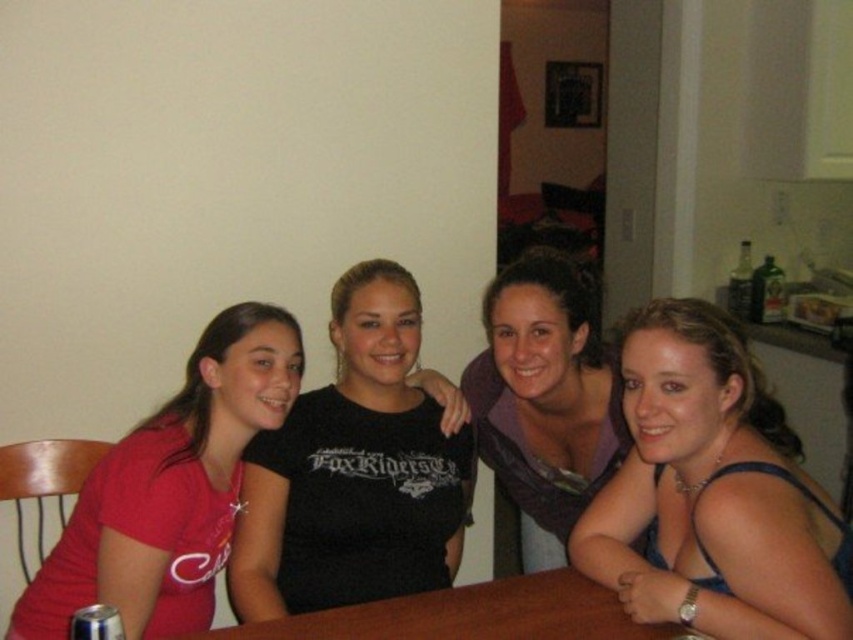
Can you confirm if blue fabric dress at center is positioned to the left of matte red shirt at left?

No, blue fabric dress at center is not to the left of matte red shirt at left.

Can you confirm if blue fabric dress at center is positioned to the right of matte red shirt at left?

Indeed, blue fabric dress at center is positioned on the right side of matte red shirt at left.

This screenshot has height=640, width=853. What do you see at coordinates (712, 493) in the screenshot?
I see `blue fabric dress at center` at bounding box center [712, 493].

Find the location of a particular element. This screenshot has height=640, width=853. blue fabric dress at center is located at coordinates (712, 493).

Can you confirm if blue fabric dress at center is positioned to the left of purple soft scarf at center?

In fact, blue fabric dress at center is to the right of purple soft scarf at center.

Does blue fabric dress at center have a lesser height compared to purple soft scarf at center?

Indeed, blue fabric dress at center has a lesser height compared to purple soft scarf at center.

Between point (637, 532) and point (564, 388), which one is positioned in front?

Point (637, 532) is in front.

Locate an element on the screen. Image resolution: width=853 pixels, height=640 pixels. blue fabric dress at center is located at coordinates (712, 493).

How much distance is there between matte red shirt at left and purple soft scarf at center?

matte red shirt at left is 23.64 inches away from purple soft scarf at center.

Who is positioned more to the right, matte red shirt at left or purple soft scarf at center?

purple soft scarf at center is more to the right.

Which is in front, point (224, 314) or point (502, 276)?

Point (502, 276) is more forward.

I want to click on matte red shirt at left, so click(x=170, y=490).